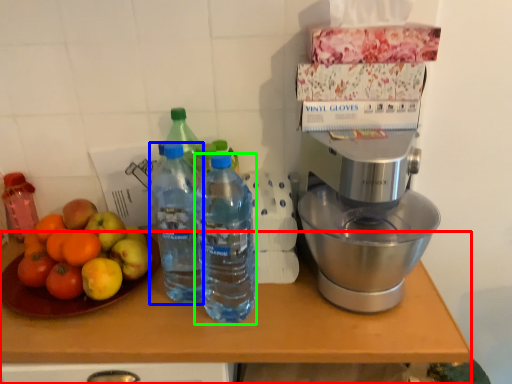
Question: Which object is positioned farthest from table (highlighted by a red box)? Select from bottle (highlighted by a blue box) and bottle (highlighted by a green box).

Choices:
 (A) bottle
 (B) bottle

Answer: (A)